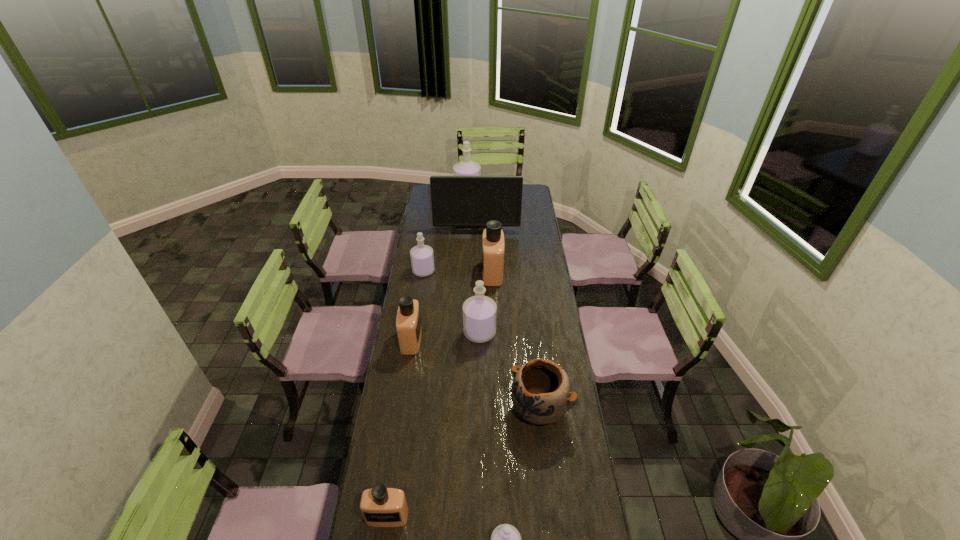
Image resolution: width=960 pixels, height=540 pixels. I want to click on vacant area between the sixth farthest perfume and the second farthest object, so click(x=432, y=371).

Image resolution: width=960 pixels, height=540 pixels. I want to click on free area in between the third smallest purple perfume and the pottery, so click(510, 370).

Identify which object is the fifth closest to the third farthest purple perfume. Please provide its 2D coordinates. Your answer should be formatted as a tuple, i.e. [(x, y)], where the tuple contains the x and y coordinates of a point satisfying the conditions above.

[(457, 201)]

Locate an element on the screen. The image size is (960, 540). object that is the third closest to the farthest beige perfume is located at coordinates (422, 259).

Identify which perfume is the sixth nearest to the eighth farthest object. Please provide its 2D coordinates. Your answer should be formatted as a tuple, i.e. [(x, y)], where the tuple contains the x and y coordinates of a point satisfying the conditions above.

[(466, 167)]

This screenshot has width=960, height=540. What are the coordinates of `perfume that stands as the third closest to the smallest purple perfume` in the screenshot? It's located at (408, 321).

This screenshot has width=960, height=540. Identify the location of purple perfume that is the third nearest to the third farthest purple perfume. (466, 167).

Identify which purple perfume is located as the second nearest to the blue pottery. Please provide its 2D coordinates. Your answer should be formatted as a tuple, i.e. [(x, y)], where the tuple contains the x and y coordinates of a point satisfying the conditions above.

[(505, 539)]

Identify which beige perfume is the second nearest to the third farthest purple perfume. Please provide its 2D coordinates. Your answer should be formatted as a tuple, i.e. [(x, y)], where the tuple contains the x and y coordinates of a point satisfying the conditions above.

[(493, 247)]

I want to click on beige perfume that is the third closest one to the computer monitor, so click(380, 506).